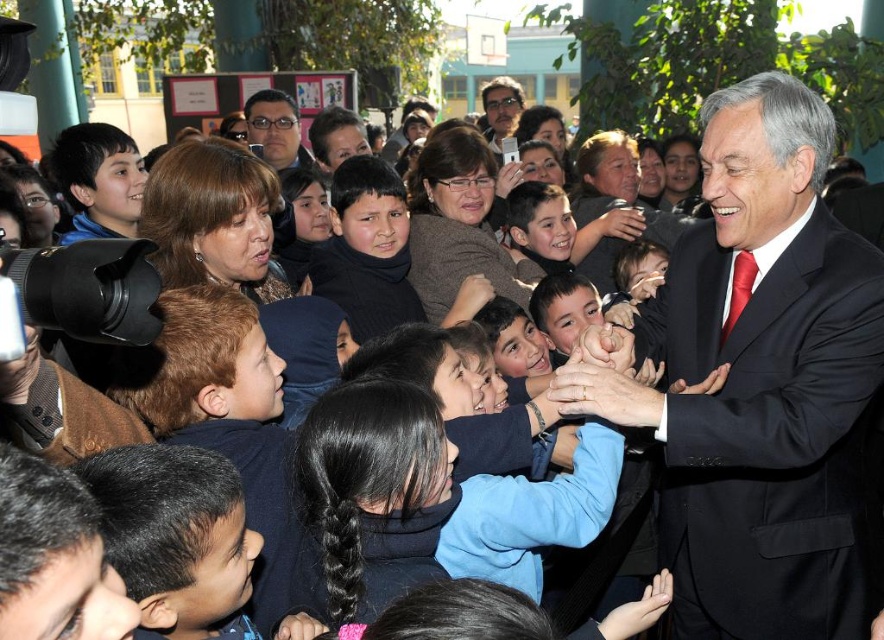
Question: Which of the following is the closest to the observer?

Choices:
 (A) (552, 387)
 (B) (326, 157)
 (C) (517, 115)

Answer: (A)

Question: Where is black suit at center located in relation to blue fleece jacket at center in the image?

Choices:
 (A) right
 (B) left

Answer: (A)

Question: Which point is farther to the camera?

Choices:
 (A) dark brown sweater at center
 (B) blue fleece jacket at center
 (C) dark brown hair at lower left
 (D) matte black suit at center

Answer: (D)

Question: Where is black suit at center located in relation to dark brown hair at lower left in the image?

Choices:
 (A) above
 (B) below

Answer: (A)

Question: Based on their relative distances, which object is farther from the blue fleece jacket at center?

Choices:
 (A) matte black suit at center
 (B) matte black jacket at center
 (C) matte black glasses at center
 (D) dark brown hair at lower left

Answer: (C)

Question: From the image, what is the correct spatial relationship of matte black jacket at center in relation to matte black suit at center?

Choices:
 (A) above
 (B) below

Answer: (B)